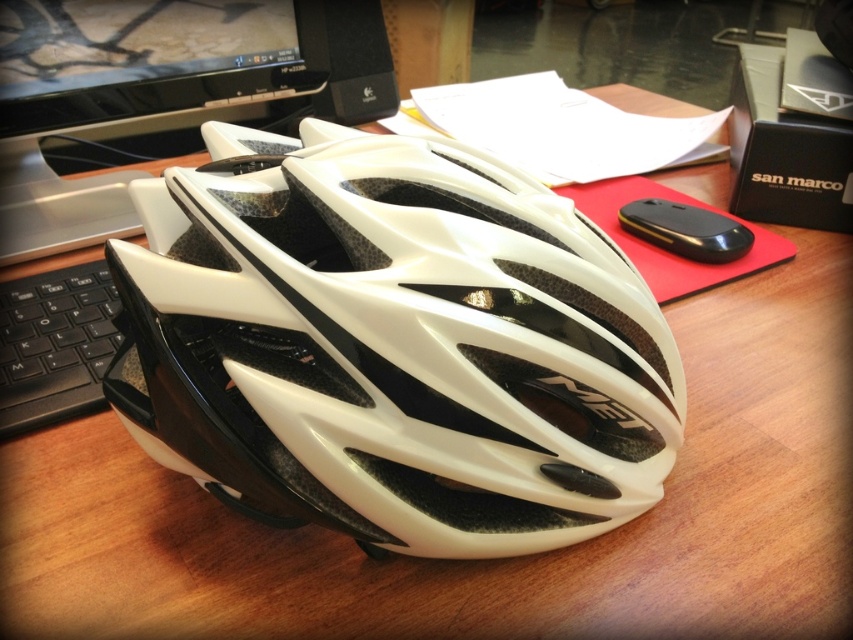
You are organizing items on a desk and need to place a new item between the white matte helmet at center and the black plastic keyboard at left. Based on their positions, which object should the new item be closer to?

The new item should be closer to the black plastic keyboard at left because the white matte helmet at center is closer to the viewer, meaning the keyboard is further back. Placing the new item closer to the keyboard would maintain the spatial arrangement.

You are standing in front of the desk and want to place a new item exactly at the same position as the white matte helmet at center. What are the coordinates where you should place it?

The white matte helmet at center is located at coordinates point [393,346], so you should place the new item at those coordinates.